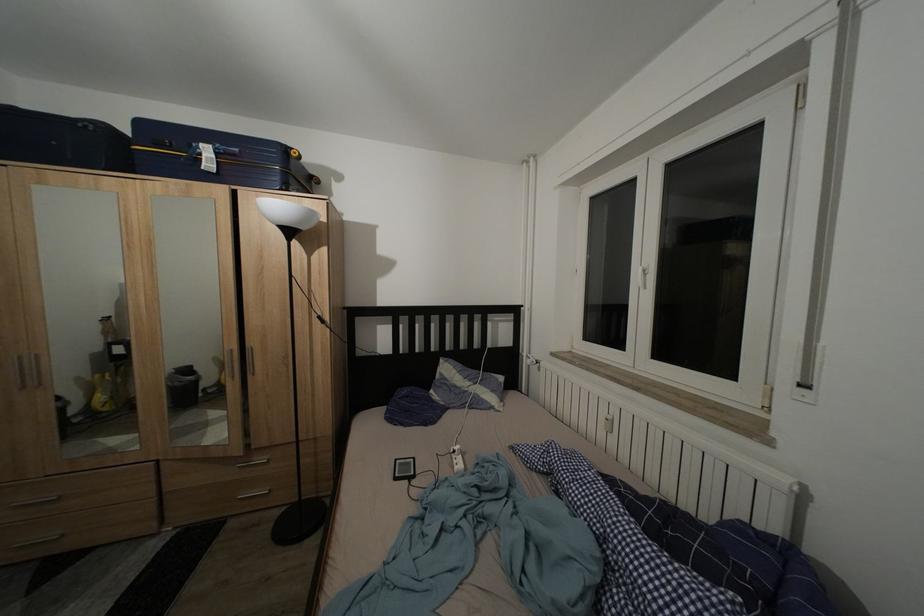
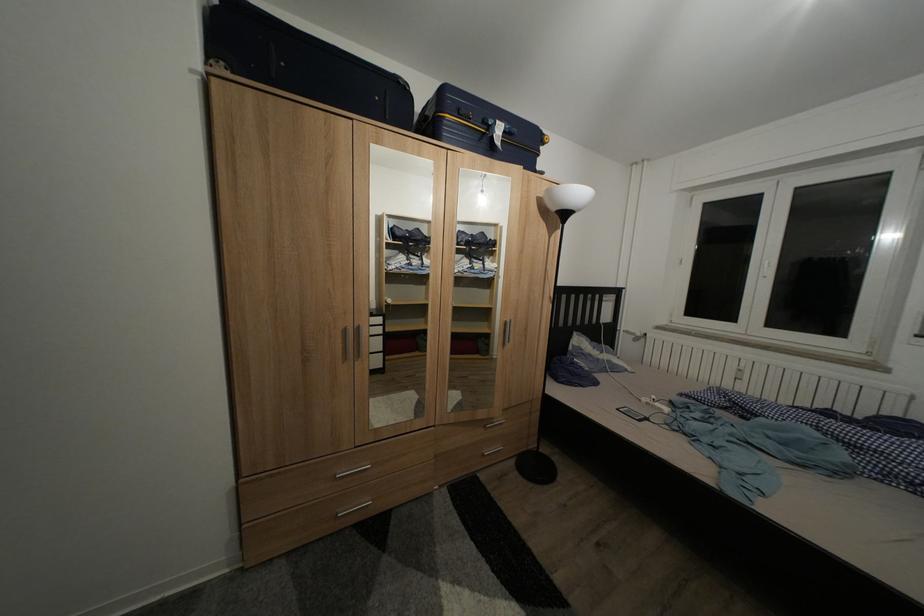
Question: In a continuous first-person perspective shot, in which direction is the camera moving?

Choices:
 (A) Left
 (B) Right
 (C) Forward
 (D) Backward

Answer: (A)